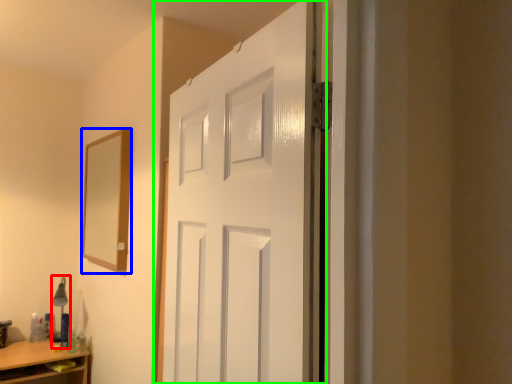
Question: Which is nearer to the table lamp (highlighted by a red box)? mirror (highlighted by a blue box) or door (highlighted by a green box).

Choices:
 (A) mirror
 (B) door

Answer: (A)